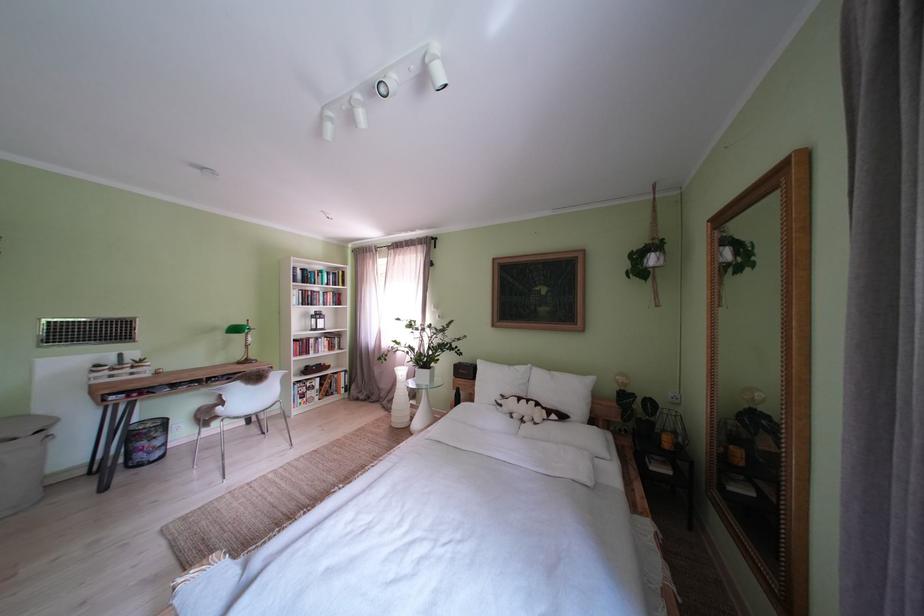
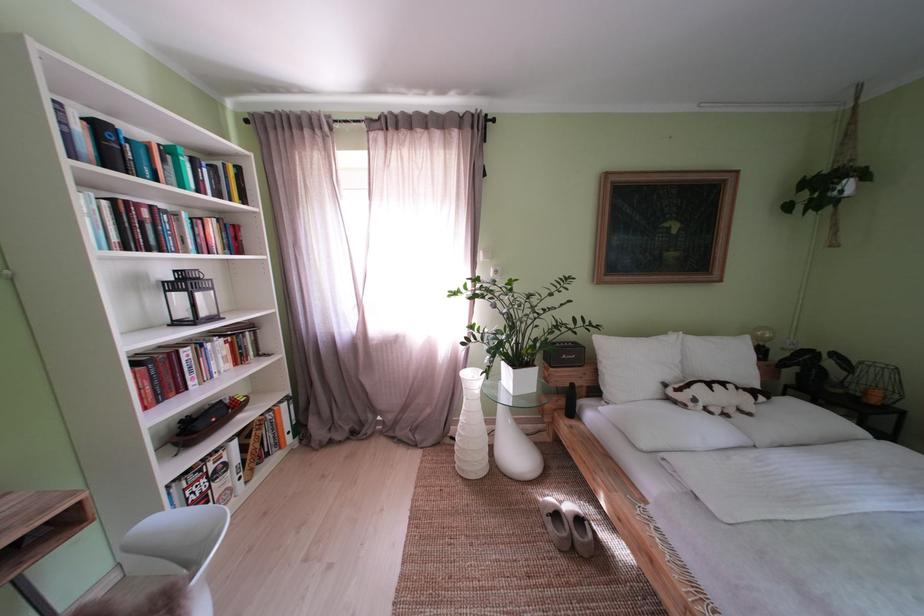
Where in the second image is the point corresponding to (x=500, y=386) from the first image?

(639, 369)